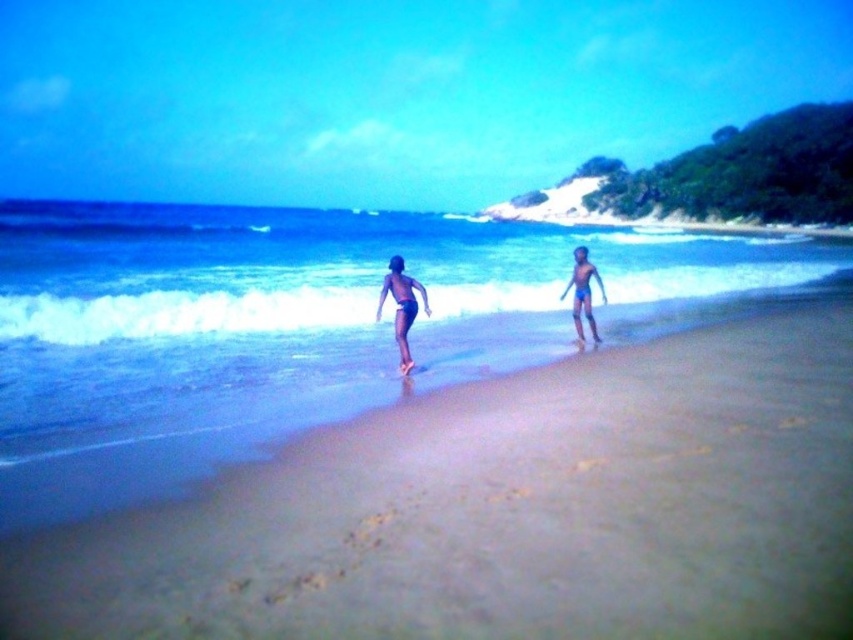
Is blue water at center to the left of dark blue swim trunks at center from the viewer's perspective?

Indeed, blue water at center is positioned on the left side of dark blue swim trunks at center.

Where is `blue water at center`? The image size is (853, 640). blue water at center is located at coordinates (299, 305).

What do you see at coordinates (299, 305) in the screenshot? The width and height of the screenshot is (853, 640). I see `blue water at center` at bounding box center [299, 305].

Identify the location of blue water at center. (299, 305).

Can you confirm if sandy beach at center is positioned above blue water at center?

No.

Between sandy beach at center and blue water at center, which one appears on the right side from the viewer's perspective?

Positioned to the right is sandy beach at center.

Is point (642, 353) closer to viewer compared to point (709, 243)?

Yes, point (642, 353) is closer to viewer.

The height and width of the screenshot is (640, 853). In order to click on sandy beach at center in this screenshot , I will do `click(508, 508)`.

Which of these two, blue water at center or matte blue shorts at center, stands taller?

Standing taller between the two is blue water at center.

Where is `blue water at center`? The height and width of the screenshot is (640, 853). blue water at center is located at coordinates (299, 305).

The width and height of the screenshot is (853, 640). Find the location of `blue water at center`. blue water at center is located at coordinates pyautogui.click(x=299, y=305).